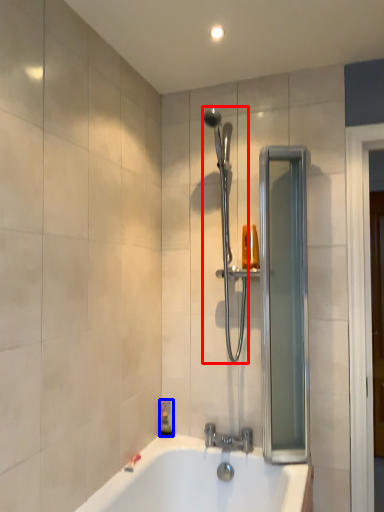
Question: Which object is further to the camera taking this photo, shower (highlighted by a red box) or soap dispenser (highlighted by a blue box)?

Choices:
 (A) shower
 (B) soap dispenser

Answer: (B)